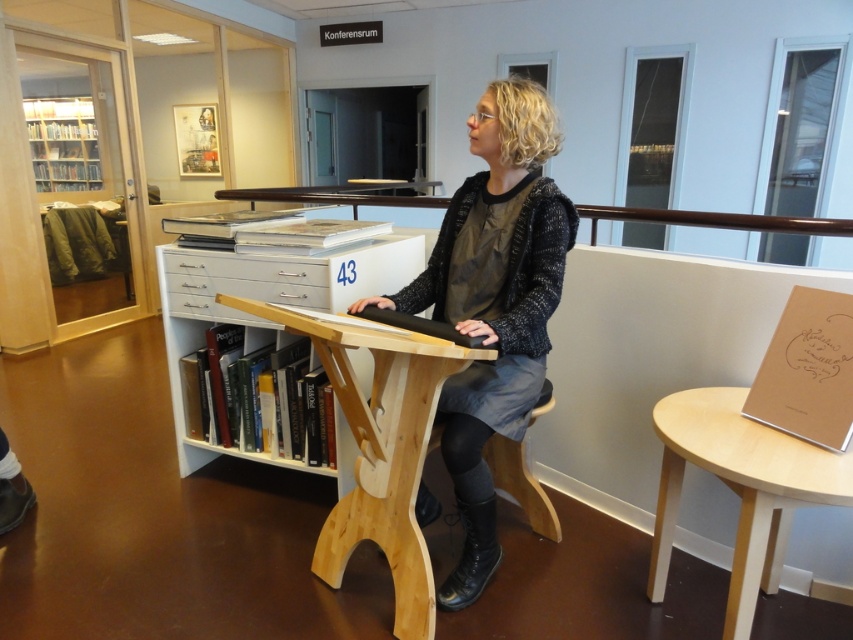
You are standing in the library and want to place a new book between the two points, point [80,156] and point [529,477]. Which point should you place the book closer to so it is closer to the viewer?

You should place the book closer to point [80,156] because it is closer to the viewer than point [529,477].

You are sitting at the table and need to reach the white glossy drawer at center. Is the light wood stool at center blocking your access to it?

The light wood stool at center is in front of the white glossy drawer at center, so it is blocking access to the drawer.

You are standing in the library and want to place a new book on the table. The book needs to be placed closer to you than the existing points on the table. Which of the two points, point [405,609] or point [318,301], should you choose?

You should choose point [405,609] because it is closer to the viewer than point [318,301].